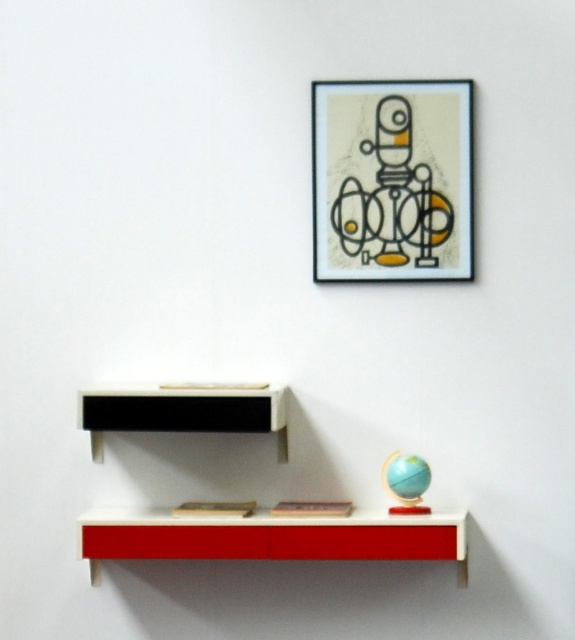
You are standing in front of the minimalist interior setup. You want to hang a new picture on the wall. The picture is slightly larger than the matte black picture frame at upper center. Where should you place it so it doesn t block the matte red cabinet at lower center?

Since the matte black picture frame at upper center is closer to you than the matte red cabinet at lower center, placing the new picture above or to the side of the existing frame will ensure it doesn t block the cabinet below.

You are standing in front of the floating shelf unit and want to place a new object between the two points labeled point (451, 140) and point (87, 532). Which point is closer to you so you can position the object accordingly?

Point (451, 140) is closer to you than point (87, 532), so you should position the object closer to that point.

You are a delivery person who needs to place a package that is 2.5 inches thick between the white glossy bookshelf at center and the matte red cabinet at lower center. Can the package fit in the space between them?

The distance between the white glossy bookshelf at center and the matte red cabinet at lower center is 2.48 inches, which is slightly less than the package thickness of 2.5 inches. Therefore, the package cannot fit in the space between them.